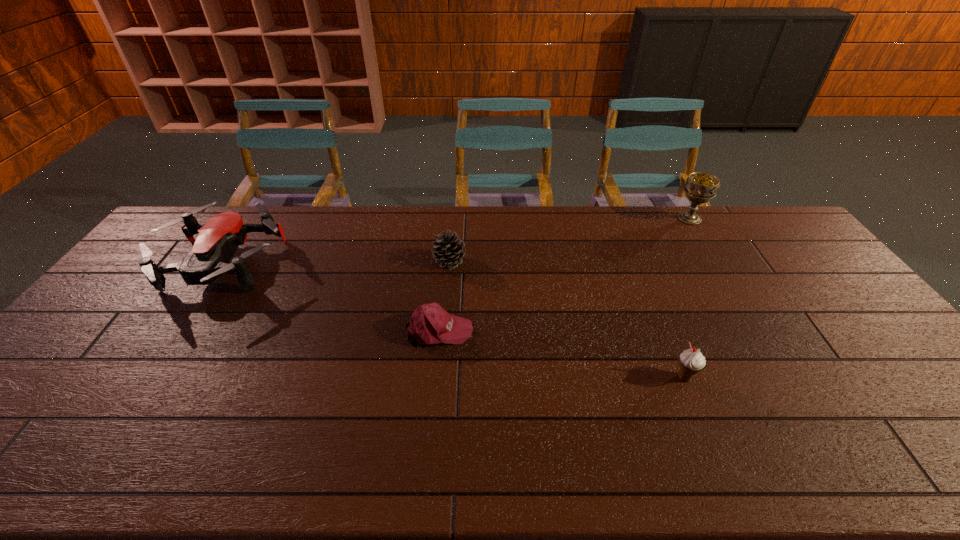
Find the location of `free space between the pinecone and the baseball cap`. free space between the pinecone and the baseball cap is located at coordinates (444, 295).

You are a GUI agent. You are given a task and a screenshot of the screen. Output one action in this format:
    pyautogui.click(x=<x>, y=<y>)
    Task: Click on the free point between the second nearest object and the pinecone
    The height and width of the screenshot is (540, 960).
    Given the screenshot: What is the action you would take?
    [444, 295]

Locate an element on the screen. The height and width of the screenshot is (540, 960). blank region between the pinecone and the fourth farthest object is located at coordinates (444, 295).

You are a GUI agent. You are given a task and a screenshot of the screen. Output one action in this format:
    pyautogui.click(x=<x>, y=<y>)
    Task: Click on the vacant space that's between the pinecone and the drone
    
    Given the screenshot: What is the action you would take?
    pyautogui.click(x=336, y=264)

Where is `vacant region between the icecream and the chalice`? The image size is (960, 540). vacant region between the icecream and the chalice is located at coordinates tap(686, 298).

Where is `vacant area between the farthest object and the pinecone`? vacant area between the farthest object and the pinecone is located at coordinates (569, 240).

Where is `the third closest object to the drone`? This screenshot has height=540, width=960. the third closest object to the drone is located at coordinates (691, 361).

In order to click on object identified as the third closest to the pinecone in this screenshot , I will do `click(691, 361)`.

You are a GUI agent. You are given a task and a screenshot of the screen. Output one action in this format:
    pyautogui.click(x=<x>, y=<y>)
    Task: Click on the free location that satisfies the following two spatial constraints: 1. on the back side of the icecream; 2. on the left side of the rightmost object
    Image resolution: width=960 pixels, height=540 pixels.
    Given the screenshot: What is the action you would take?
    pyautogui.click(x=619, y=219)

This screenshot has height=540, width=960. Find the location of `vacant point that satisfies the following two spatial constraints: 1. on the camera side of the leftmost object; 2. on the right side of the second object from right to left`. vacant point that satisfies the following two spatial constraints: 1. on the camera side of the leftmost object; 2. on the right side of the second object from right to left is located at coordinates (150, 377).